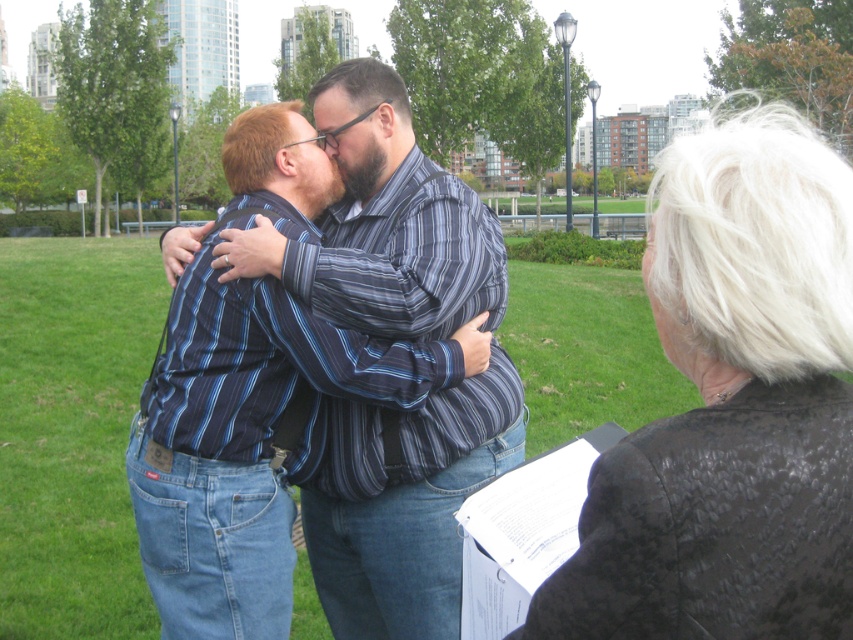
Is point (753, 225) positioned after point (431, 630)?

No.

What do you see at coordinates (730, 406) in the screenshot?
I see `white textured hair at upper right` at bounding box center [730, 406].

Is point (808, 227) positioned before point (409, 538)?

Yes, point (808, 227) is closer to viewer.

Where is `white textured hair at upper right`? white textured hair at upper right is located at coordinates (730, 406).